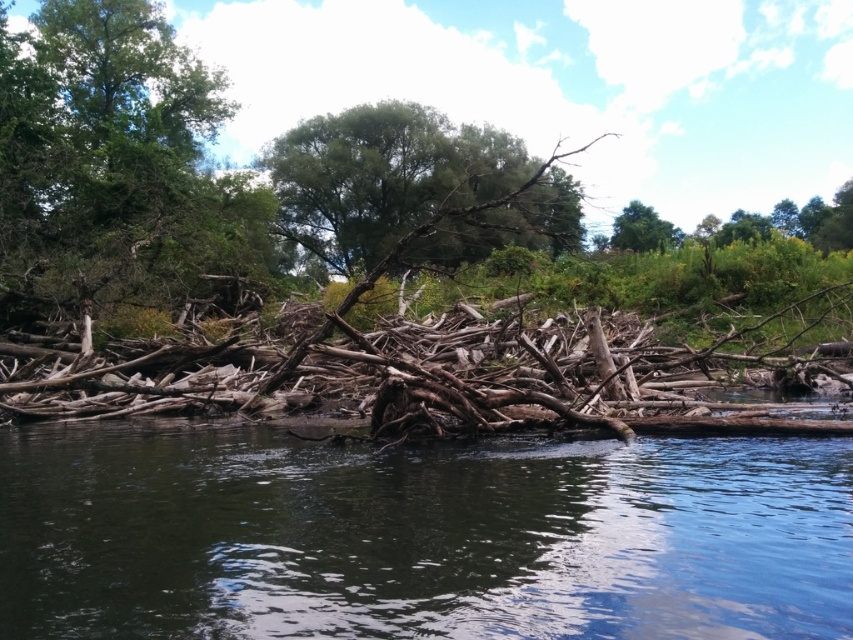
Question: Which of these objects is positioned closest to the brown rough driftwood at center?

Choices:
 (A) green leafy tree at upper center
 (B) green leafy tree at upper right
 (C) green leafy tree at center
 (D) green rough bark tree at upper left

Answer: (D)

Question: Among these objects, which one is nearest to the camera?

Choices:
 (A) green leafy tree at upper right
 (B) green leafy tree at upper center
 (C) green rough bark tree at upper left
 (D) green leafy tree at center

Answer: (D)

Question: Which object is closer to the camera taking this photo?

Choices:
 (A) green leafy tree at center
 (B) brown rough driftwood at center

Answer: (B)

Question: Does brown rough driftwood at center lie in front of green leafy tree at upper right?

Choices:
 (A) yes
 (B) no

Answer: (A)

Question: Is dark brown wood at center to the right of green leafy tree at center from the viewer's perspective?

Choices:
 (A) no
 (B) yes

Answer: (A)

Question: Does green rough bark tree at upper left lie in front of green leafy tree at upper center?

Choices:
 (A) yes
 (B) no

Answer: (A)